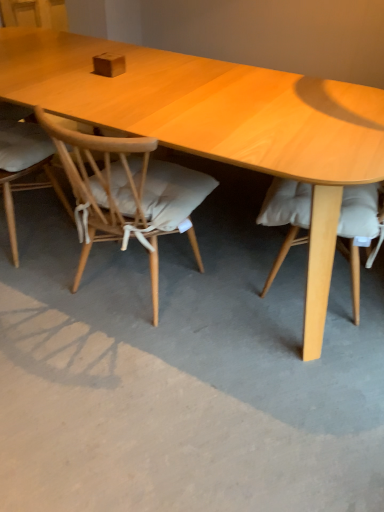
Question: In which direction should I rotate to look at light wood chair at center, the second chair viewed from the left?

Choices:
 (A) left
 (B) right

Answer: (A)

Question: Is light wood chair at center, the second chair viewed from the left, bigger than light brown wood chair at left, which is the second chair in right-to-left order?

Choices:
 (A) yes
 (B) no

Answer: (A)

Question: Is light wood chair at center, the second chair viewed from the left, at the left side of light brown wood chair at left, the first chair viewed from the left?

Choices:
 (A) yes
 (B) no

Answer: (B)

Question: Considering the relative sizes of light wood chair at center, the 1th chair viewed from the right, and light brown wood chair at left, which is the second chair in right-to-left order, in the image provided, is light wood chair at center, the 1th chair viewed from the right, thinner than light brown wood chair at left, which is the second chair in right-to-left order,?

Choices:
 (A) yes
 (B) no

Answer: (B)

Question: Considering the relative positions of light wood chair at center, the second chair viewed from the left, and light brown wood chair at left, the first chair viewed from the left, in the image provided, is light wood chair at center, the second chair viewed from the left, to the right of light brown wood chair at left, the first chair viewed from the left, from the viewer's perspective?

Choices:
 (A) yes
 (B) no

Answer: (A)

Question: Does light wood chair at center, the second chair viewed from the left, lie in front of light brown wood chair at left, the first chair viewed from the left?

Choices:
 (A) no
 (B) yes

Answer: (B)

Question: Is light wood chair at center, the 1th chair viewed from the right, completely or partially outside of light brown wood chair at left, which is the second chair in right-to-left order?

Choices:
 (A) no
 (B) yes

Answer: (B)

Question: Is light wood chair at center, the 1th chair viewed from the right, not near gray concrete at center?

Choices:
 (A) no
 (B) yes

Answer: (A)

Question: Is light wood chair at center, the second chair viewed from the left, closer to the viewer compared to gray concrete at center?

Choices:
 (A) yes
 (B) no

Answer: (B)

Question: Is light wood chair at center, the 1th chair viewed from the right, not inside gray concrete at center?

Choices:
 (A) no
 (B) yes

Answer: (B)

Question: Is gray concrete at center completely or partially inside light wood chair at center, the 1th chair viewed from the right?

Choices:
 (A) no
 (B) yes

Answer: (A)

Question: Is the surface of light wood chair at center, the second chair viewed from the left, in direct contact with gray concrete at center?

Choices:
 (A) no
 (B) yes

Answer: (A)

Question: From a real-world perspective, is light wood chair at center, the second chair viewed from the left, positioned under gray concrete at center based on gravity?

Choices:
 (A) yes
 (B) no

Answer: (B)

Question: Is light wood chair at center, the second chair viewed from the left, inside gray concrete at center?

Choices:
 (A) yes
 (B) no

Answer: (B)